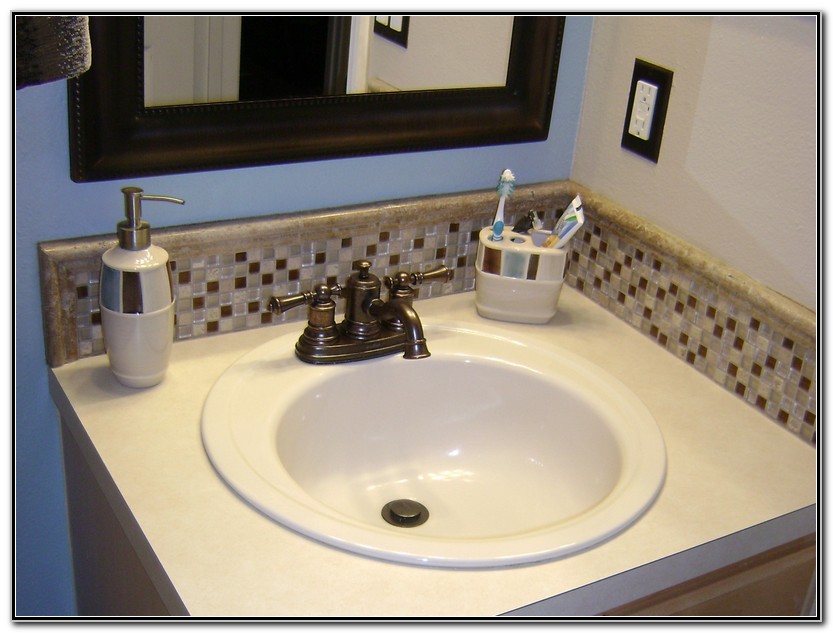
Identify the location of blue wall background. The image size is (833, 633). (287, 192).